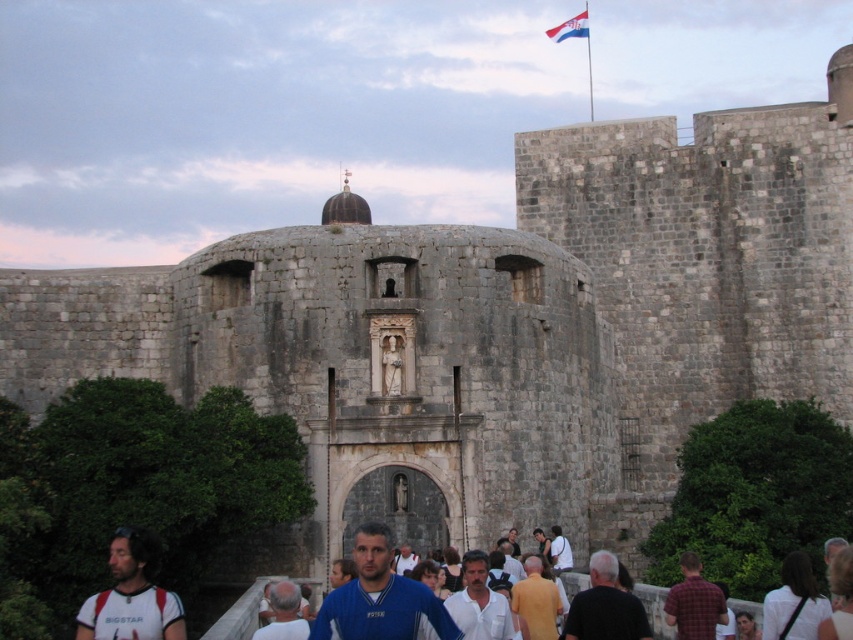
Between white fabric shirt at lower left and plaid shirt at lower right, which one has less height?

Standing shorter between the two is plaid shirt at lower right.

Describe the element at coordinates (131, 595) in the screenshot. This screenshot has width=853, height=640. I see `white fabric shirt at lower left` at that location.

Where is `white fabric shirt at lower left`? white fabric shirt at lower left is located at coordinates (131, 595).

Can you confirm if white fabric at lower right is thinner than plaid shirt at lower right?

Incorrect, white fabric at lower right's width is not less than plaid shirt at lower right's.

Who is taller, white fabric at lower right or plaid shirt at lower right?

white fabric at lower right is taller.

Between point (807, 572) and point (708, 611), which one is positioned in front?

Point (807, 572)

This screenshot has width=853, height=640. I want to click on white fabric at lower right, so click(x=793, y=602).

Between black matte shirt at center and white fabric at lower right, which one appears on the right side from the viewer's perspective?

Positioned to the right is white fabric at lower right.

Can you confirm if black matte shirt at center is taller than white fabric at lower right?

Yes.

Is point (579, 627) farther from viewer compared to point (799, 596)?

No, it is in front of (799, 596).

Find the location of a particular element. black matte shirt at center is located at coordinates (605, 605).